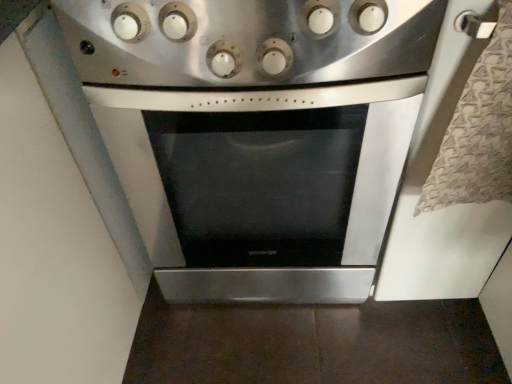
Question: Does satin silver knobs at upper center have a greater width compared to stainless steel oven at center?

Choices:
 (A) yes
 (B) no

Answer: (B)

Question: Considering the relative sizes of satin silver knobs at upper center and stainless steel oven at center in the image provided, is satin silver knobs at upper center thinner than stainless steel oven at center?

Choices:
 (A) yes
 (B) no

Answer: (A)

Question: Is stainless steel oven at center surrounded by satin silver knobs at upper center?

Choices:
 (A) no
 (B) yes

Answer: (A)

Question: Is satin silver knobs at upper center not within stainless steel oven at center?

Choices:
 (A) yes
 (B) no

Answer: (A)

Question: Is satin silver knobs at upper center positioned in front of stainless steel oven at center?

Choices:
 (A) yes
 (B) no

Answer: (A)

Question: From the image's perspective, is satin silver knobs at upper center above stainless steel oven at center?

Choices:
 (A) no
 (B) yes

Answer: (B)

Question: Is stainless steel oven at center not inside satin silver knobs at upper center?

Choices:
 (A) no
 (B) yes

Answer: (B)

Question: Is stainless steel oven at center shorter than satin silver knobs at upper center?

Choices:
 (A) yes
 (B) no

Answer: (B)

Question: Can you confirm if stainless steel oven at center is positioned to the right of satin silver knobs at upper center?

Choices:
 (A) yes
 (B) no

Answer: (A)

Question: From the image's perspective, is stainless steel oven at center under satin silver knobs at upper center?

Choices:
 (A) no
 (B) yes

Answer: (B)

Question: Can you confirm if stainless steel oven at center is wider than satin silver knobs at upper center?

Choices:
 (A) no
 (B) yes

Answer: (B)

Question: Is there a large distance between stainless steel oven at center and satin silver knobs at upper center?

Choices:
 (A) yes
 (B) no

Answer: (B)

Question: Based on their positions, is satin silver knobs at upper center located to the left or right of stainless steel oven at center?

Choices:
 (A) left
 (B) right

Answer: (A)